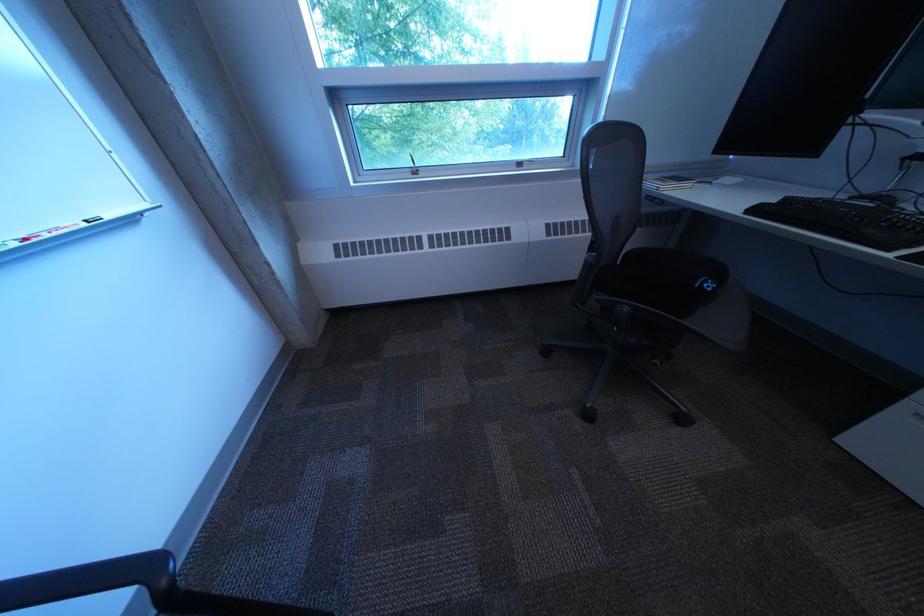
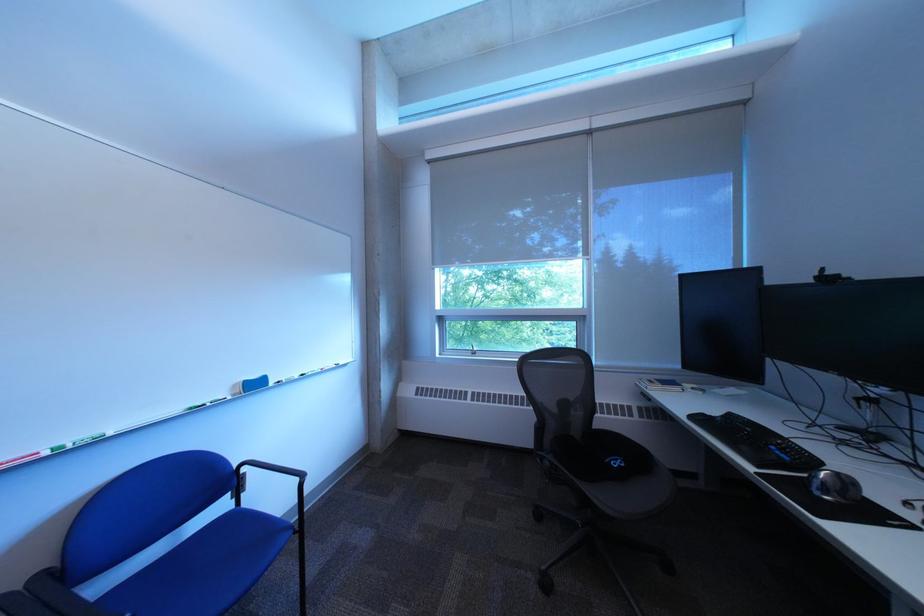
Locate, in the second image, the point that corresponds to the point at 428,167 in the first image.

(488, 351)